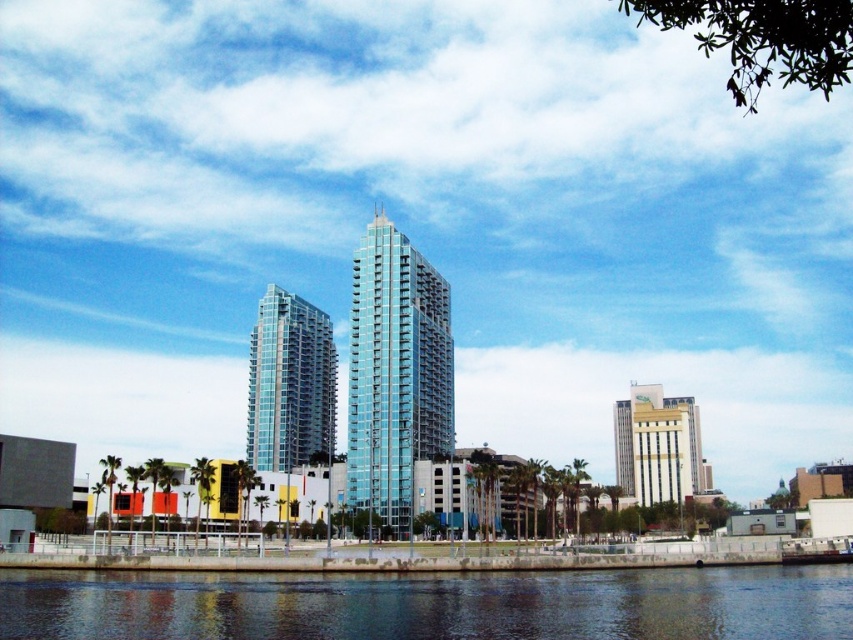
You are standing on the walkway at the waterfront and want to reach the dark blue water at lower center to take a photo. Considering the distance, can you comfortably walk to it without any obstacles?

The dark blue water at lower center is 132.86 feet away from you. Since this distance is manageable for walking, you can comfortably reach it without any obstacles mentioned in the scene.

You are standing on the concrete walkway along the waterfront and want to take a photo of the dark blue water at lower center. Based on its coordinates, where should you position yourself to ensure the water is centered in your camera view?

The dark blue water at lower center is located at point coordinates (432, 604), so you should position yourself directly facing that coordinate to center it in your camera view.